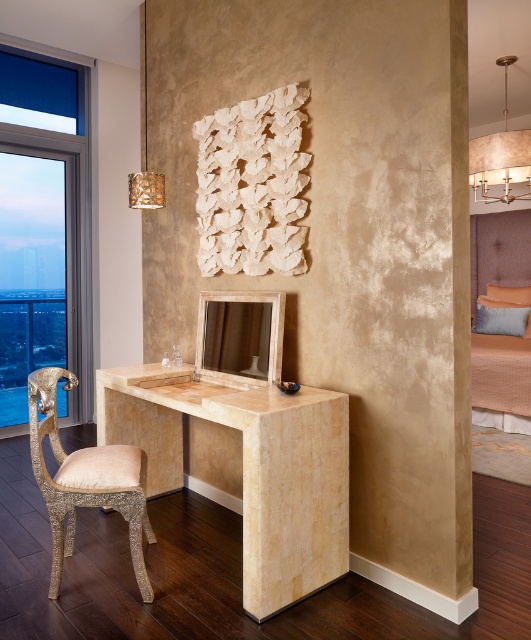
Question: Estimate the real-world distances between objects in this image. Which object is closer to the clear glass window at left?

Choices:
 (A) beige marble desk at center
 (B) beige fabric bed at right
 (C) gold glittery armchair at left
 (D) beige marble pillar at center

Answer: (D)

Question: Which point is closer to the camera?

Choices:
 (A) gold glittery armchair at left
 (B) beige fabric bed at right
 (C) clear glass window at left
 (D) beige marble pillar at center

Answer: (D)

Question: Can you confirm if clear glass window at left is positioned to the left of beige fabric bed at right?

Choices:
 (A) yes
 (B) no

Answer: (A)

Question: Among these objects, which one is nearest to the camera?

Choices:
 (A) beige fabric bed at right
 (B) beige marble pillar at center
 (C) beige marble desk at center
 (D) clear glass window at left

Answer: (B)

Question: Can you confirm if beige marble desk at center is positioned below beige fabric bed at right?

Choices:
 (A) no
 (B) yes

Answer: (B)

Question: Can you confirm if beige marble pillar at center is positioned above beige marble desk at center?

Choices:
 (A) no
 (B) yes

Answer: (B)